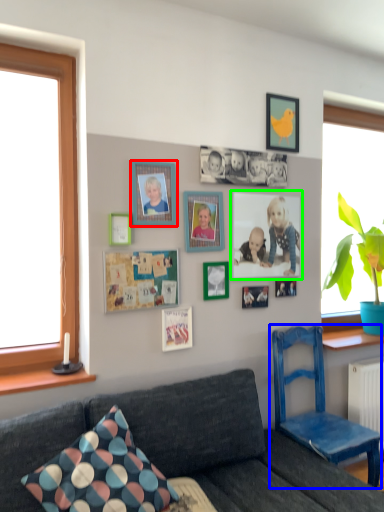
Question: Estimate the real-world distances between objects in this image. Which object is closer to picture frame (highlighted by a red box), chair (highlighted by a blue box) or picture frame (highlighted by a green box)?

Choices:
 (A) chair
 (B) picture frame

Answer: (B)